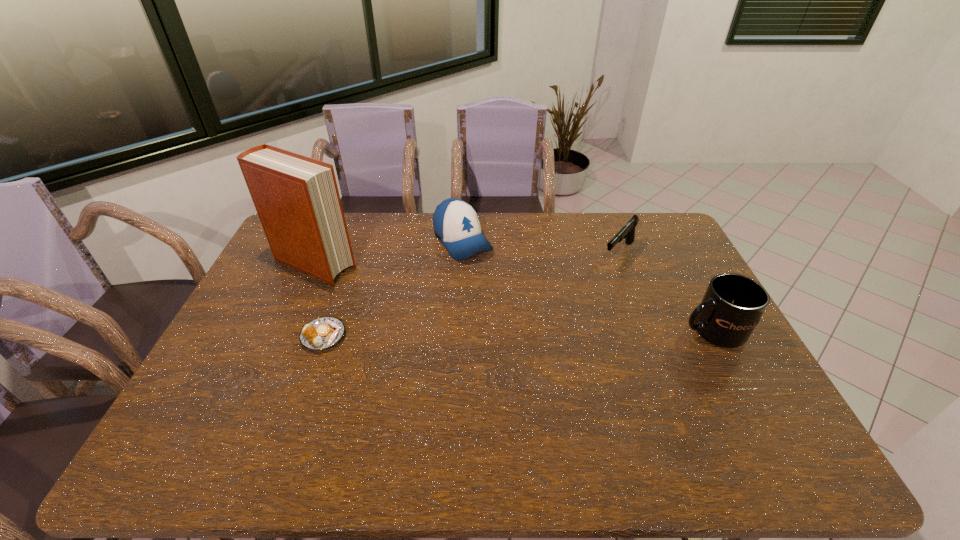
At what (x,y) coordinates should I click in order to perform the action: click on hardback book present at the far edge. Please return your answer as a coordinate pair (x, y). Looking at the image, I should click on (297, 200).

Find the location of a particular element. gun located at the far edge is located at coordinates (627, 232).

The image size is (960, 540). What are the coordinates of `object situated at the left edge` in the screenshot? It's located at (297, 200).

Find the location of a particular element. The width and height of the screenshot is (960, 540). object positioned at the right edge is located at coordinates (732, 306).

In order to click on object that is at the far left corner in this screenshot , I will do `click(297, 200)`.

In the image, there is a desktop. At what (x,y) coordinates should I click in order to perform the action: click on free space at the far edge. Please return your answer as a coordinate pair (x, y). This screenshot has width=960, height=540. Looking at the image, I should click on (597, 228).

The image size is (960, 540). I want to click on free space at the near edge, so click(x=617, y=418).

Identify the location of blank area at the left edge. This screenshot has width=960, height=540. (218, 387).

Where is `blank space at the right edge of the desktop`? The height and width of the screenshot is (540, 960). blank space at the right edge of the desktop is located at coordinates coord(683,327).

You are a GUI agent. You are given a task and a screenshot of the screen. Output one action in this format:
    pyautogui.click(x=<x>, y=<y>)
    Task: Click on the free space at the near left corner of the desktop
    
    Given the screenshot: What is the action you would take?
    pyautogui.click(x=224, y=396)